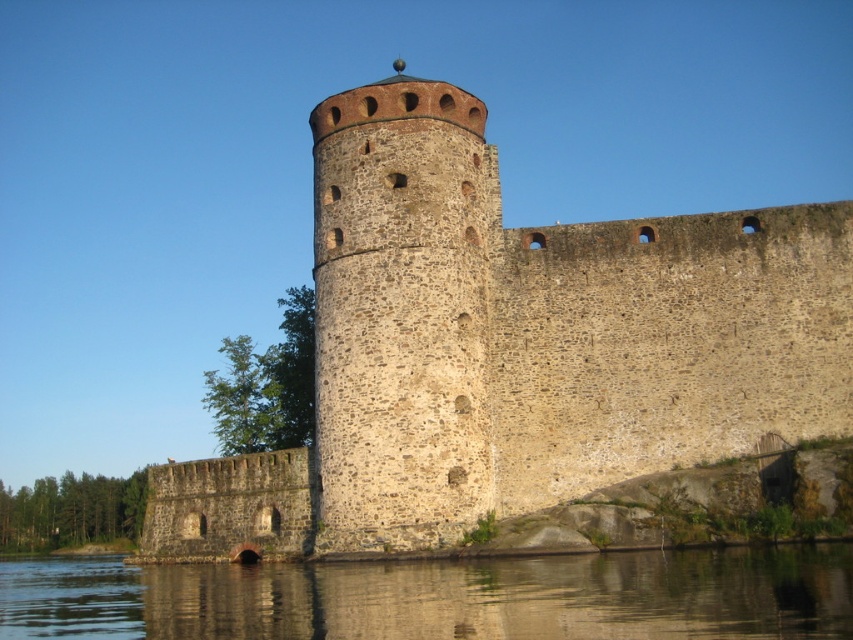
Is stone wall at center bigger than stone tower at center?

Indeed, stone wall at center has a larger size compared to stone tower at center.

Which is more to the right, stone wall at center or stone tower at center?

From the viewer's perspective, stone wall at center appears more on the right side.

Is point (631, 340) closer to camera compared to point (331, 502)?

No, (631, 340) is further to viewer.

Identify the location of stone wall at center. Image resolution: width=853 pixels, height=640 pixels. (511, 346).

From the picture: Is stone wall at center thinner than smooth water at lower center?

Yes, stone wall at center is thinner than smooth water at lower center.

Is stone wall at center shorter than smooth water at lower center?

No, stone wall at center is not shorter than smooth water at lower center.

You are a GUI agent. You are given a task and a screenshot of the screen. Output one action in this format:
    pyautogui.click(x=<x>, y=<y>)
    Task: Click on the stone wall at center
    This screenshot has height=640, width=853.
    Given the screenshot: What is the action you would take?
    pyautogui.click(x=511, y=346)

Find the location of a particular element. This screenshot has width=853, height=640. stone wall at center is located at coordinates (511, 346).

Is point (498, 257) farther from camera compared to point (105, 600)?

That is True.

Does stone tower at center appear on the right side of smooth water at lower center?

Correct, you'll find stone tower at center to the right of smooth water at lower center.

Is point (370, 435) in front of point (624, 634)?

That is False.

Find the location of a particular element. The width and height of the screenshot is (853, 640). stone tower at center is located at coordinates (401, 314).